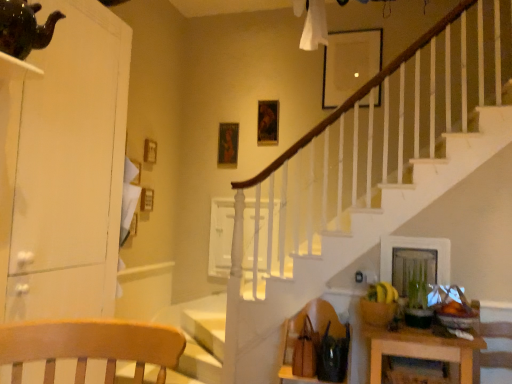
This screenshot has height=384, width=512. Find the location of `green matte plant at lower right`. green matte plant at lower right is located at coordinates (418, 287).

This screenshot has width=512, height=384. In order to click on wooden picture frame at upper center, placed as the first picture frame when sorted from right to left in this screenshot , I will do `click(349, 63)`.

This screenshot has height=384, width=512. What do you see at coordinates (64, 167) in the screenshot?
I see `white glossy dresser at left` at bounding box center [64, 167].

Locate an element on the screen. green matte plant at lower right is located at coordinates (418, 287).

Are wooden picture frame at upper center, which is the 2th picture frame in left-to-right order, and wooden table at lower right beside each other?

No, wooden picture frame at upper center, which is the 2th picture frame in left-to-right order, is not making contact with wooden table at lower right.

Visually, is wooden picture frame at upper center, which is the 2th picture frame in left-to-right order, positioned to the left or to the right of wooden table at lower right?

In the image, wooden picture frame at upper center, which is the 2th picture frame in left-to-right order, appears on the left side of wooden table at lower right.

From a real-world perspective, is wooden picture frame at upper center, arranged as the second picture frame when viewed from the back, over wooden table at lower right?

Yes, from a real-world perspective, wooden picture frame at upper center, arranged as the second picture frame when viewed from the back, is on top of wooden table at lower right.

Can you confirm if wooden picture frame at upper center, arranged as the second picture frame when viewed from the back, is thinner than wooden table at lower right?

Yes.

Would you consider metallic gold picture frame at upper center, which is counted as the third picture frame, starting from the right, to be distant from white glossy dresser at left?

Yes, metallic gold picture frame at upper center, which is counted as the third picture frame, starting from the right, and white glossy dresser at left are located far from each other.

Locate an element on the screen. The width and height of the screenshot is (512, 384). dresser on the left of metallic gold picture frame at upper center, marked as the third picture frame in a front-to-back arrangement is located at coordinates (64, 167).

Is metallic gold picture frame at upper center, the 1th picture frame in the left-to-right sequence, shorter than white glossy dresser at left?

Yes.

Between metallic gold picture frame at upper center, marked as the third picture frame in a front-to-back arrangement, and white glossy dresser at left, which one is positioned in front?

Positioned in front is white glossy dresser at left.

Is wooden table at lower right far from white glossy dresser at left?

Indeed, wooden table at lower right is not near white glossy dresser at left.

Where is `table behind the white glossy dresser at left`? The width and height of the screenshot is (512, 384). table behind the white glossy dresser at left is located at coordinates (420, 349).

Which object is further away from the camera taking this photo, wooden table at lower right or white glossy dresser at left?

wooden table at lower right is further away from the camera.

Would you say wooden table at lower right is to the left or to the right of white glossy dresser at left in the picture?

Based on their positions, wooden table at lower right is located to the right of white glossy dresser at left.

Could you tell me if green matte plant at lower right is turned towards wooden picture frame at upper center, the 2th picture frame positioned from the right?

No, green matte plant at lower right is not turned towards wooden picture frame at upper center, the 2th picture frame positioned from the right.

Is green matte plant at lower right positioned far away from wooden picture frame at upper center, which appears as the 2th picture frame when viewed from the front?

Absolutely, green matte plant at lower right is distant from wooden picture frame at upper center, which appears as the 2th picture frame when viewed from the front.

Which object is positioned more to the right, green matte plant at lower right or wooden picture frame at upper center, the 2th picture frame positioned from the right?

Positioned to the right is green matte plant at lower right.

This screenshot has width=512, height=384. Find the location of `plant below the wooden picture frame at upper center, the 2th picture frame positioned from the right (from the image's perspective)`. plant below the wooden picture frame at upper center, the 2th picture frame positioned from the right (from the image's perspective) is located at coordinates (418, 287).

Considering the positions of point (351, 78) and point (45, 237), is point (351, 78) closer or farther from the camera than point (45, 237)?

Point (351, 78).

Is wooden picture frame at upper center, the 1th picture frame positioned from the front, aimed at white glossy dresser at left?

No, wooden picture frame at upper center, the 1th picture frame positioned from the front, is not turned towards white glossy dresser at left.

Which object is closer to the camera, wooden picture frame at upper center, which appears as the 2th picture frame when viewed from the front, or metallic gold picture frame at upper center, arranged as the first picture frame when viewed from the back?

wooden picture frame at upper center, which appears as the 2th picture frame when viewed from the front, is more forward.

Based on the photo, in terms of size, does wooden picture frame at upper center, the 2th picture frame positioned from the right, appear bigger or smaller than metallic gold picture frame at upper center, arranged as the first picture frame when viewed from the back?

In the image, wooden picture frame at upper center, the 2th picture frame positioned from the right, appears to be larger than metallic gold picture frame at upper center, arranged as the first picture frame when viewed from the back.

Considering the relative sizes of wooden picture frame at upper center, the 2th picture frame positioned from the right, and metallic gold picture frame at upper center, marked as the third picture frame in a front-to-back arrangement, in the image provided, is wooden picture frame at upper center, the 2th picture frame positioned from the right, thinner than metallic gold picture frame at upper center, marked as the third picture frame in a front-to-back arrangement,?

No, wooden picture frame at upper center, the 2th picture frame positioned from the right, is not thinner than metallic gold picture frame at upper center, marked as the third picture frame in a front-to-back arrangement.

From the image's perspective, is wooden picture frame at upper center, which is the 2th picture frame in left-to-right order, above metallic gold picture frame at upper center, the 1th picture frame in the left-to-right sequence?

Indeed, from the image's perspective, wooden picture frame at upper center, which is the 2th picture frame in left-to-right order, is shown above metallic gold picture frame at upper center, the 1th picture frame in the left-to-right sequence.

Is brown leather armchair at lower right next to wooden table at lower right?

brown leather armchair at lower right and wooden table at lower right are clearly separated.

Based on the photo, how different are the orientations of brown leather armchair at lower right and wooden table at lower right in degrees?

The facing directions of brown leather armchair at lower right and wooden table at lower right are 0.501 degrees apart.

Which of these two, brown leather armchair at lower right or wooden table at lower right, is thinner?

With smaller width is brown leather armchair at lower right.

Could you tell me if brown leather armchair at lower right is turned towards wooden table at lower right?

No, brown leather armchair at lower right is not aimed at wooden table at lower right.

Identify the location of table located in front of the wooden picture frame at upper center, which appears as the 2th picture frame when viewed from the front. (420, 349).

In order to click on dresser on the left of metallic gold picture frame at upper center, marked as the third picture frame in a front-to-back arrangement in this screenshot , I will do `click(64, 167)`.

Which object lies nearer to the anchor point wooden table at lower right, white glossy dresser at left or brown leather armchair at lower right?

Among the two, brown leather armchair at lower right is located nearer to wooden table at lower right.

In the scene shown: From the image, which object appears to be nearer to green matte plant at lower right, wooden picture frame at upper center, the 1th picture frame positioned from the front, or wooden picture frame at upper center, which appears as the 2th picture frame when viewed from the front?

Among the two, wooden picture frame at upper center, the 1th picture frame positioned from the front, is located nearer to green matte plant at lower right.

Which object lies nearer to the anchor point wooden picture frame at upper center, placed as the first picture frame when sorted from right to left, wooden picture frame at upper center, which appears as the 2th picture frame when viewed from the front, or metallic gold picture frame at upper center, which is counted as the third picture frame, starting from the right?

wooden picture frame at upper center, which appears as the 2th picture frame when viewed from the front, lies closer to wooden picture frame at upper center, placed as the first picture frame when sorted from right to left, than the other object.

Looking at the image, which one is located further to brown leather armchair at lower right, wooden picture frame at upper center, arranged as the second picture frame when viewed from the back, or white glossy dresser at left?

Among the two, wooden picture frame at upper center, arranged as the second picture frame when viewed from the back, is located further to brown leather armchair at lower right.

Estimate the real-world distances between objects in this image. Which object is further from metallic gold picture frame at upper center, arranged as the first picture frame when viewed from the back, wooden picture frame at upper center, the 2th picture frame positioned from the right, or green matte plant at lower right?

Based on the image, green matte plant at lower right appears to be further to metallic gold picture frame at upper center, arranged as the first picture frame when viewed from the back.

From the image, which object appears to be nearer to wooden table at lower right, wooden picture frame at upper center, the 1th picture frame positioned from the front, or white glossy dresser at left?

The object closer to wooden table at lower right is white glossy dresser at left.

Based on the photo, when comparing their distances from wooden picture frame at upper center, which appears as the 2th picture frame when viewed from the front, does wooden picture frame at upper center, the 1th picture frame positioned from the front, or wooden table at lower right seem further?

wooden table at lower right.

Considering their positions, is wooden picture frame at upper center, which is the 2th picture frame in left-to-right order, positioned closer to brown leather armchair at lower right than wooden picture frame at upper center, placed as the first picture frame when sorted from right to left?

Based on the image, wooden picture frame at upper center, which is the 2th picture frame in left-to-right order, appears to be nearer to brown leather armchair at lower right.

Identify the location of table between white glossy dresser at left and metallic gold picture frame at upper center, the 1th picture frame in the left-to-right sequence, from front to back. The width and height of the screenshot is (512, 384). (420, 349).

The height and width of the screenshot is (384, 512). In order to click on plant between wooden picture frame at upper center, placed as the first picture frame when sorted from right to left, and wooden table at lower right from top to bottom in this screenshot , I will do `click(418, 287)`.

Find the location of a particular element. picture frame between white glossy dresser at left and wooden picture frame at upper center, which is the 2th picture frame in left-to-right order, along the z-axis is located at coordinates (349, 63).

Identify the location of armchair between green matte plant at lower right and wooden picture frame at upper center, which appears as the 2th picture frame when viewed from the front, in the front-back direction. The image size is (512, 384). (314, 335).